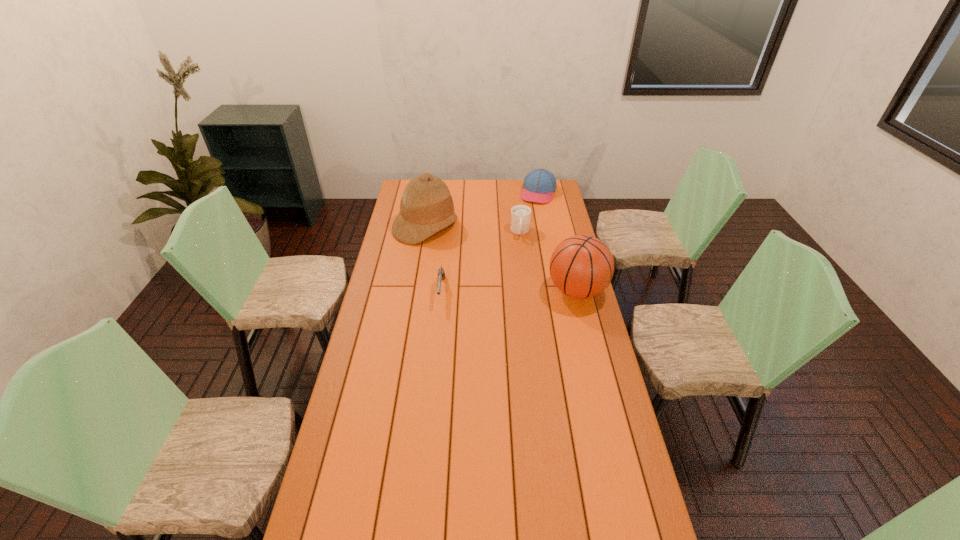
Where is `vacant space on the desktop that is between the shortest object and the basketball and is positioned on the side with the handle of the cappuccino`? The height and width of the screenshot is (540, 960). vacant space on the desktop that is between the shortest object and the basketball and is positioned on the side with the handle of the cappuccino is located at coordinates (519, 291).

At what (x,y) coordinates should I click in order to perform the action: click on free space on the desktop that is between the gun and the basketball and is positioned on the front-facing side of the hat. Please return your answer as a coordinate pair (x, y). The image size is (960, 540). Looking at the image, I should click on (528, 291).

At what (x,y) coordinates should I click in order to perform the action: click on vacant space on the desktop that is between the gun and the basketball and is positioned on the front-facing side of the baseball cap. Please return your answer as a coordinate pair (x, y). This screenshot has height=540, width=960. Looking at the image, I should click on click(502, 291).